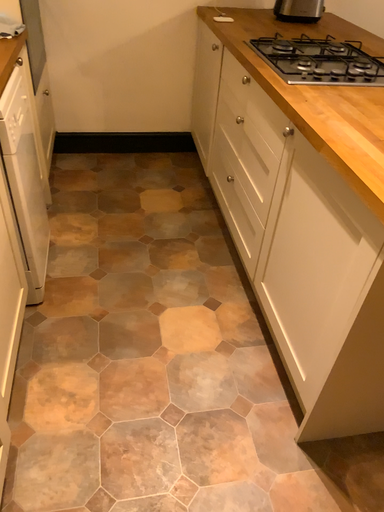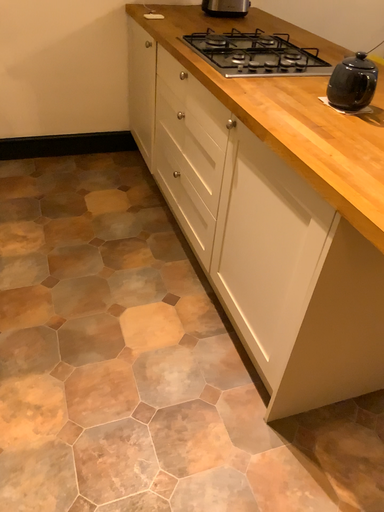
Question: Which way did the camera rotate in the video?

Choices:
 (A) rotated left
 (B) rotated right

Answer: (B)